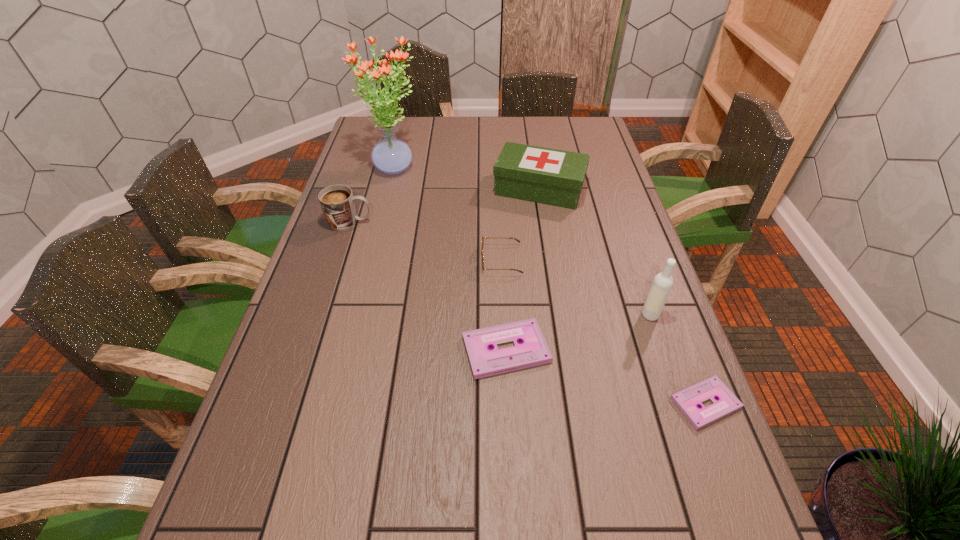
Locate an element on the screen. The height and width of the screenshot is (540, 960). object that can be found as the closest to the first-aid kit is located at coordinates (517, 240).

The image size is (960, 540). What are the coordinates of `free space that satisfies the following two spatial constraints: 1. on the lenses of the fourth farthest object; 2. on the back side of the vodka` in the screenshot? It's located at (504, 315).

You are a GUI agent. You are given a task and a screenshot of the screen. Output one action in this format:
    pyautogui.click(x=<x>, y=<y>)
    Task: Click on the free space that satisfies the following two spatial constraints: 1. on the lenses of the fifth tallest object; 2. on the left side of the fifth farthest object
    The image size is (960, 540).
    Given the screenshot: What is the action you would take?
    pyautogui.click(x=504, y=315)

I want to click on free spot that satisfies the following two spatial constraints: 1. on the side of the vodka with the handle; 2. on the left side of the fifth nearest object, so click(321, 315).

This screenshot has height=540, width=960. I want to click on free spot that satisfies the following two spatial constraints: 1. on the back side of the sixth tallest object; 2. on the right side of the second tallest object, so click(x=504, y=315).

What are the coordinates of `vacant region that satisfies the following two spatial constraints: 1. on the side of the mug with the handle; 2. on the left side of the right videotape` in the screenshot? It's located at (292, 403).

At what (x,y) coordinates should I click in order to perform the action: click on free region that satisfies the following two spatial constraints: 1. on the front side of the first-aid kit; 2. on the left side of the shortest object. Please return your answer as a coordinate pair (x, y). The width and height of the screenshot is (960, 540). Looking at the image, I should click on (573, 403).

Locate an element on the screen. Image resolution: width=960 pixels, height=540 pixels. blank area in the image that satisfies the following two spatial constraints: 1. on the front side of the tallest object; 2. on the side of the fifth nearest object with the handle is located at coordinates (379, 222).